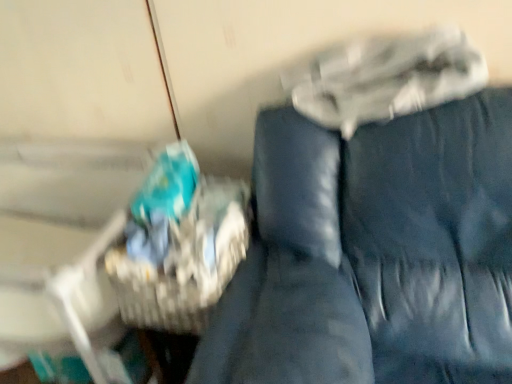
Question: Does woven brown basket at left have a lesser width compared to blue fabric couch at center?

Choices:
 (A) yes
 (B) no

Answer: (A)

Question: Are woven brown basket at left and blue fabric couch at center located far from each other?

Choices:
 (A) no
 (B) yes

Answer: (A)

Question: Is woven brown basket at left facing towards blue fabric couch at center?

Choices:
 (A) yes
 (B) no

Answer: (B)

Question: Is woven brown basket at left at the right side of blue fabric couch at center?

Choices:
 (A) yes
 (B) no

Answer: (B)

Question: From the image's perspective, is woven brown basket at left located beneath blue fabric couch at center?

Choices:
 (A) no
 (B) yes

Answer: (A)

Question: Can you confirm if woven brown basket at left is smaller than blue fabric couch at center?

Choices:
 (A) yes
 (B) no

Answer: (A)

Question: Is blue fabric couch at center in front of woven brown basket at left?

Choices:
 (A) yes
 (B) no

Answer: (A)

Question: From a real-world perspective, is blue fabric couch at center beneath woven brown basket at left?

Choices:
 (A) yes
 (B) no

Answer: (A)

Question: Is blue fabric couch at center aimed at woven brown basket at left?

Choices:
 (A) no
 (B) yes

Answer: (A)

Question: From the image's perspective, is blue fabric couch at center beneath woven brown basket at left?

Choices:
 (A) no
 (B) yes

Answer: (B)

Question: Can you confirm if blue fabric couch at center is wider than woven brown basket at left?

Choices:
 (A) no
 (B) yes

Answer: (B)

Question: Can you confirm if blue fabric couch at center is smaller than woven brown basket at left?

Choices:
 (A) no
 (B) yes

Answer: (A)

Question: From a real-world perspective, relative to blue fabric couch at center, is woven brown basket at left vertically above or below?

Choices:
 (A) above
 (B) below

Answer: (A)